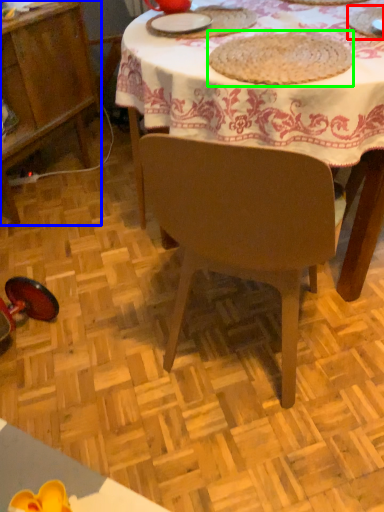
Question: Estimate the real-world distances between objects in this image. Which object is closer to tableware (highlighted by a red box), cabinetry (highlighted by a blue box) or food (highlighted by a green box)?

Choices:
 (A) cabinetry
 (B) food

Answer: (B)